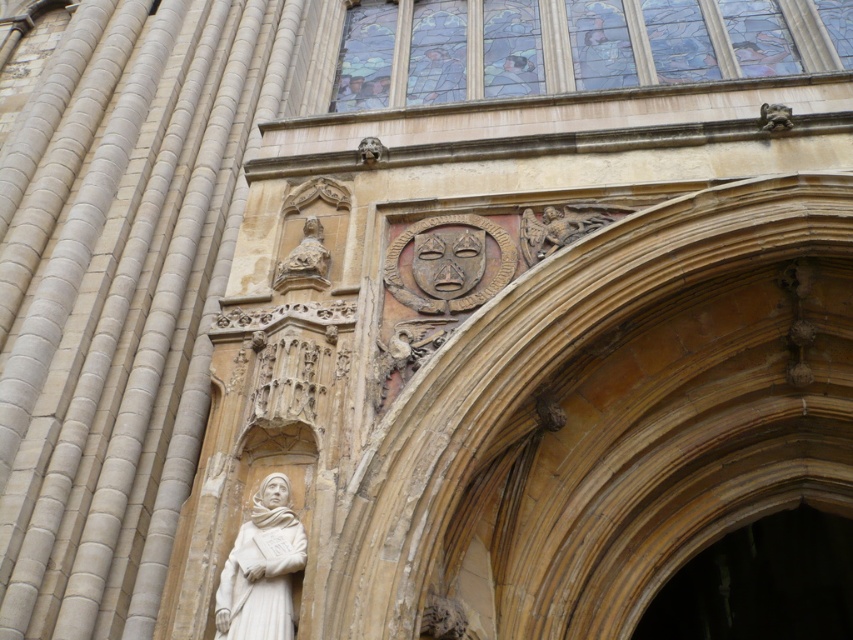
Question: Which object is closer to the camera taking this photo?

Choices:
 (A) white stone statue at lower left
 (B) stained glass at upper center
 (C) stone statue at upper center
 (D) wooden archway at center

Answer: (A)

Question: Which object is the farthest from the stained glass at upper center?

Choices:
 (A) stone statue at upper center
 (B) wooden archway at center
 (C) white stone statue at lower left

Answer: (C)

Question: Is stained glass at upper center to the right of stone statue at upper center from the viewer's perspective?

Choices:
 (A) no
 (B) yes

Answer: (B)

Question: Considering the relative positions of stained glass at upper center and wooden archway at center in the image provided, where is stained glass at upper center located with respect to wooden archway at center?

Choices:
 (A) below
 (B) above

Answer: (B)

Question: Does stained glass at upper center have a greater width compared to stone statue at upper center?

Choices:
 (A) no
 (B) yes

Answer: (B)

Question: Which point is closer to the camera?

Choices:
 (A) (505, 49)
 (B) (730, 566)

Answer: (B)